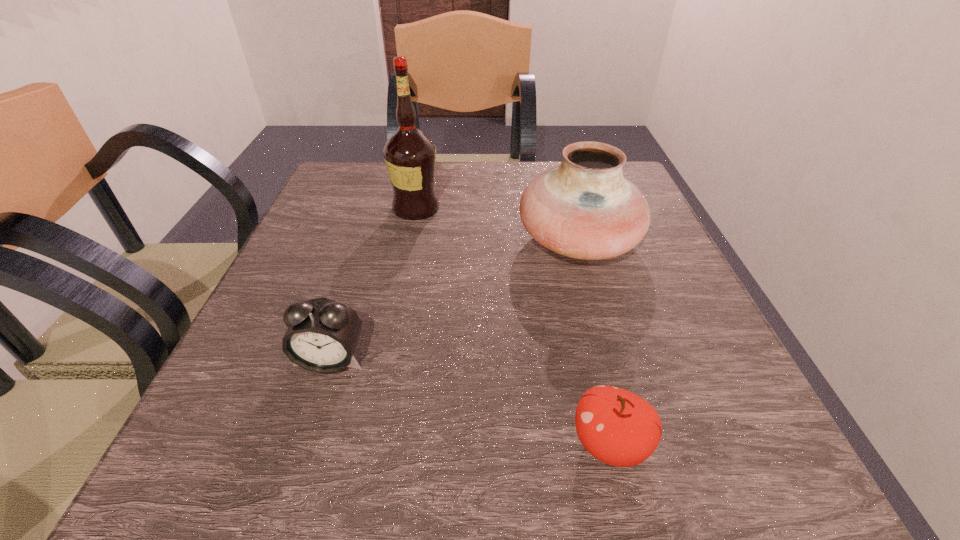
Locate an element on the screen. alcohol is located at coordinates (410, 156).

I want to click on the third shortest object, so click(585, 209).

The image size is (960, 540). In order to click on the third farthest object in this screenshot , I will do `click(322, 334)`.

Locate an element on the screen. apple is located at coordinates (616, 426).

Locate an element on the screen. free space located 0.330m on the label of the alcohol is located at coordinates (586, 208).

This screenshot has height=540, width=960. In order to click on vacant region located on the front of the pottery in this screenshot , I will do `click(601, 322)`.

The image size is (960, 540). Find the location of `free spot located on the front side of the second nearest object`. free spot located on the front side of the second nearest object is located at coordinates (287, 495).

The width and height of the screenshot is (960, 540). What are the coordinates of `vacant space located 0.110m on the right of the apple` in the screenshot? It's located at point(733,444).

You are a GUI agent. You are given a task and a screenshot of the screen. Output one action in this format:
    pyautogui.click(x=<x>, y=<y>)
    Task: Click on the alcohol at the far edge
    The width and height of the screenshot is (960, 540).
    Given the screenshot: What is the action you would take?
    pyautogui.click(x=410, y=156)

Image resolution: width=960 pixels, height=540 pixels. Identify the location of pottery located at the far edge. (585, 209).